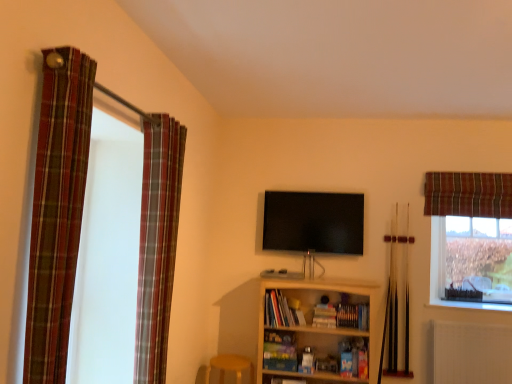
Question: Considering the positions of plaid fabric curtain at left, which is counted as the second curtain, starting from the back, and plaid fabric curtain at upper right, arranged as the third curtain when viewed from the front, in the image, is plaid fabric curtain at left, which is counted as the second curtain, starting from the back, taller or shorter than plaid fabric curtain at upper right, arranged as the third curtain when viewed from the front,?

Choices:
 (A) short
 (B) tall

Answer: (B)

Question: In terms of width, does plaid fabric curtain at left, which appears as the 2th curtain when viewed from the right, look wider or thinner when compared to plaid fabric curtain at upper right, positioned as the 1th curtain in back-to-front order?

Choices:
 (A) wide
 (B) thin

Answer: (A)

Question: Which object is the closest to the light brown wooden stool at lower left?

Choices:
 (A) white textured radiator at lower right
 (B) clear glass window at upper right
 (C) flat screen tv at center
 (D) plaid fabric curtain at left, acting as the 1th curtain starting from the left
 (E) hardcover books at center, the second book viewed from the right

Answer: (E)

Question: Considering the real-world distances, which object is closest to the plaid fabric curtain at left, which appears as the 2th curtain when viewed from the right?

Choices:
 (A) flat screen tv at center
 (B) plaid fabric curtain at left, acting as the 3th curtain starting from the right
 (C) light brown wooden stool at lower left
 (D) light wood bookshelf at center
 (E) hardcover book at center, acting as the first book starting from the right

Answer: (B)